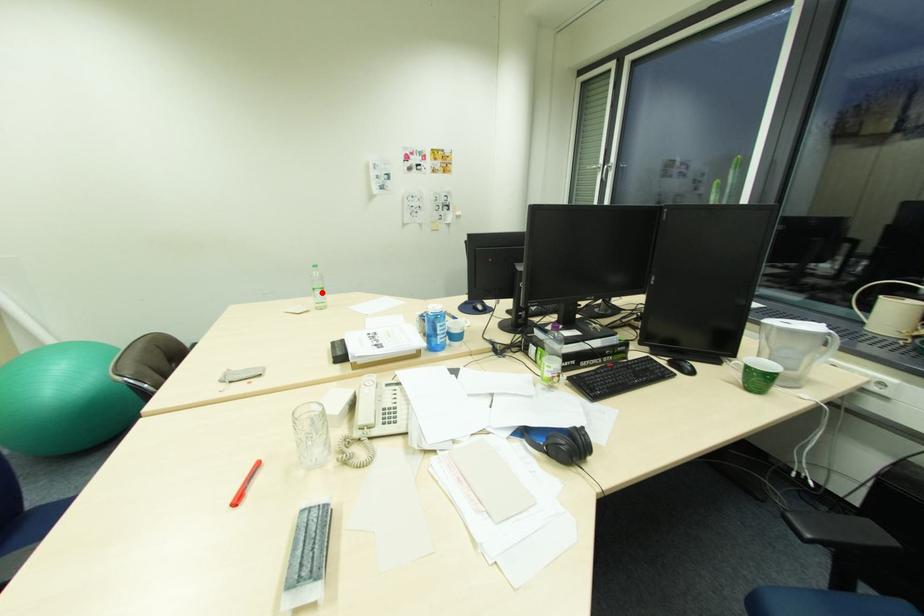
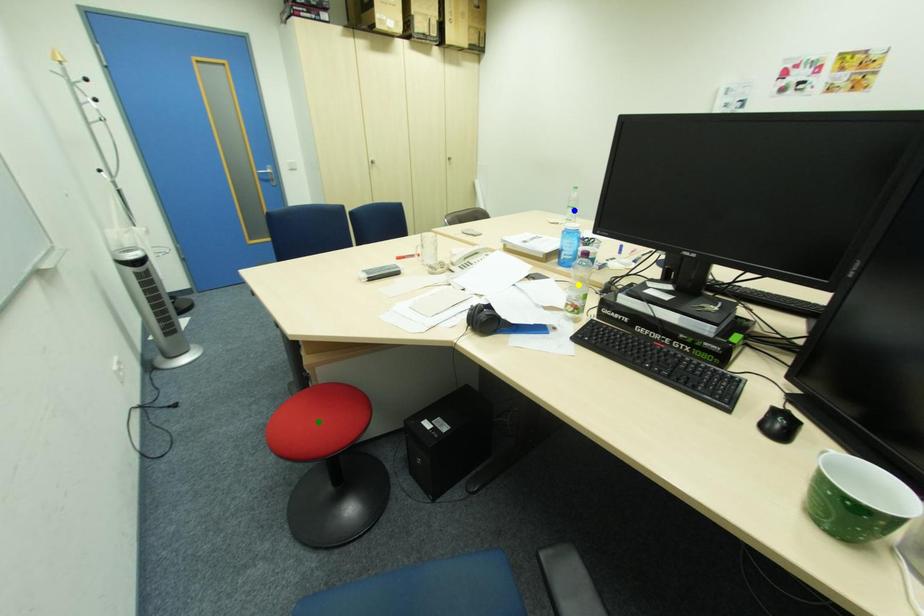
Question: I am providing you with two images of the same scene from different viewpoints. A red point is marked on the first image. You are given multiple points on the second image. In image 2, which mark is for the same physical point as the one in image 1?

Choices:
 (A) green point
 (B) blue point
 (C) yellow point

Answer: (B)